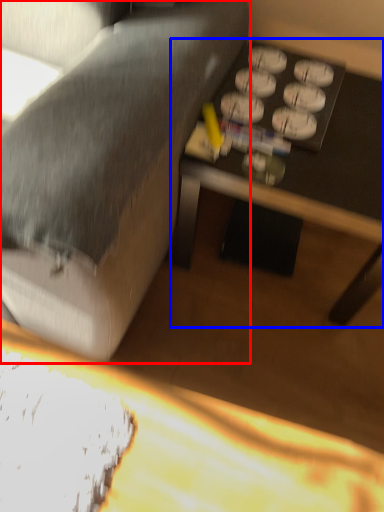
Question: Which object appears closest to the camera in this image, studio couch (highlighted by a red box) or table (highlighted by a blue box)?

Choices:
 (A) studio couch
 (B) table

Answer: (A)